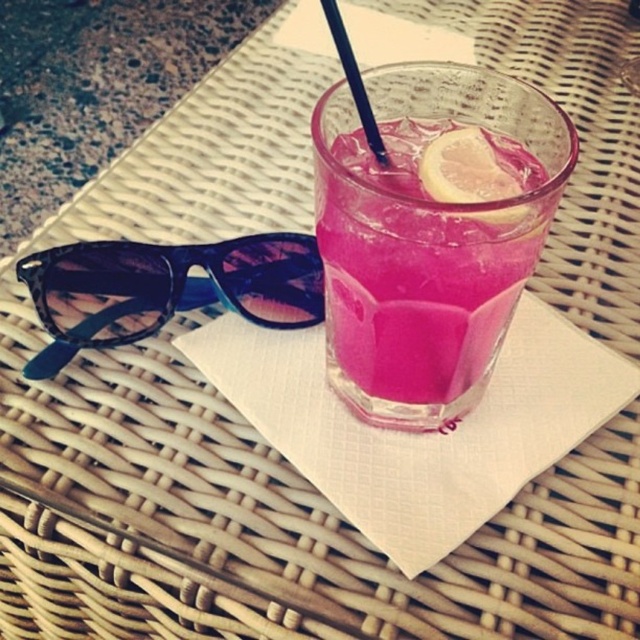
Question: Considering the real-world distances, which object is farthest from the pink glass at center?

Choices:
 (A) transparent plastic straw at upper center
 (B) translucent yellow lemon at center
 (C) leopard print acetate sunglasses at left

Answer: (C)

Question: Which point is closer to the camera?

Choices:
 (A) transparent plastic straw at upper center
 (B) leopard print acetate sunglasses at left
 (C) translucent yellow lemon at center
 (D) pink glass at center

Answer: (D)

Question: Is pink glass at center wider than transparent plastic straw at upper center?

Choices:
 (A) no
 (B) yes

Answer: (B)

Question: Is leopard print acetate sunglasses at left smaller than translucent yellow lemon at center?

Choices:
 (A) no
 (B) yes

Answer: (A)

Question: Estimate the real-world distances between objects in this image. Which object is closer to the leopard print acetate sunglasses at left?

Choices:
 (A) translucent yellow lemon at center
 (B) pink glass at center

Answer: (B)

Question: Can you confirm if leopard print acetate sunglasses at left is positioned to the right of transparent plastic straw at upper center?

Choices:
 (A) no
 (B) yes

Answer: (A)